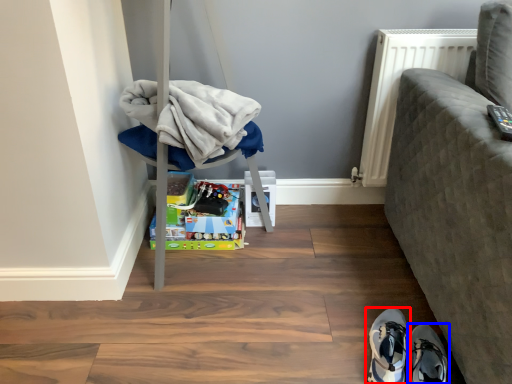
Question: Among these objects, which one is farthest to the camera, footwear (highlighted by a red box) or footwear (highlighted by a blue box)?

Choices:
 (A) footwear
 (B) footwear

Answer: (A)